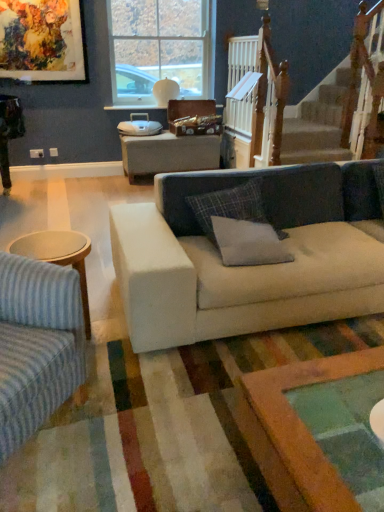
Where is `free spot to the right of light blue fabric couch at left, placed as the second studio couch when sorted from right to left`? The height and width of the screenshot is (512, 384). free spot to the right of light blue fabric couch at left, placed as the second studio couch when sorted from right to left is located at coordinates (135, 428).